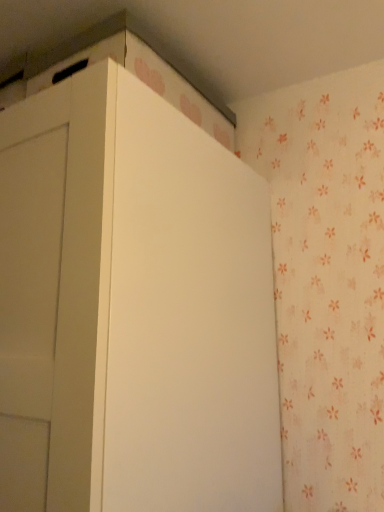
In order to face white matte cabinet at upper left, should I rotate leftwards or rightwards?

Rotate your view left by about 20.247°.

Locate an element on the screen. Image resolution: width=384 pixels, height=512 pixels. white matte cabinet at upper left is located at coordinates (139, 303).

What do you see at coordinates (139, 303) in the screenshot? The width and height of the screenshot is (384, 512). I see `white matte cabinet at upper left` at bounding box center [139, 303].

Where is `white matte cabinet at upper left`? The height and width of the screenshot is (512, 384). white matte cabinet at upper left is located at coordinates (139, 303).